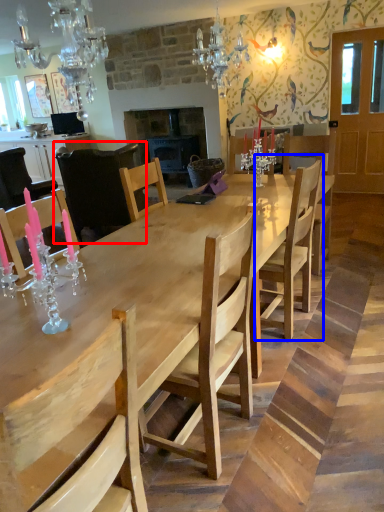
Question: Which object appears closest to the camera in this image, chair (highlighted by a red box) or chair (highlighted by a blue box)?

Choices:
 (A) chair
 (B) chair

Answer: (B)